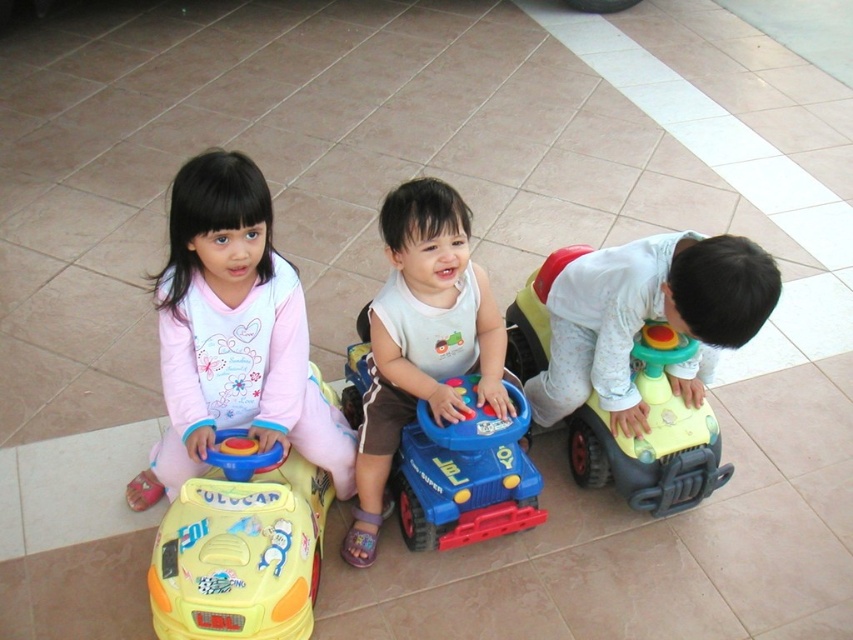
Question: Can you confirm if pink matte/polyester dress at center is smaller than blue plastic toy car at center?

Choices:
 (A) yes
 (B) no

Answer: (B)

Question: Which point is closer to the camera taking this photo?

Choices:
 (A) (436, 310)
 (B) (201, 634)
 (C) (451, 467)
 (D) (770, 280)

Answer: (B)

Question: Does matte blue toy car at center come in front of yellow plastic toy car at left?

Choices:
 (A) no
 (B) yes

Answer: (A)

Question: Is matte white toy car at right bigger than yellow plastic toy car at left?

Choices:
 (A) yes
 (B) no

Answer: (A)

Question: Which object appears farthest from the camera in this image?

Choices:
 (A) matte blue toy car at center
 (B) pink matte/polyester dress at center
 (C) matte white toy car at right

Answer: (A)

Question: Estimate the real-world distances between objects in this image. Which object is farther from the matte white toy car at right?

Choices:
 (A) yellow plastic toy car at left
 (B) pink matte/polyester dress at center
 (C) matte blue toy car at center
 (D) blue plastic toy car at center

Answer: (A)